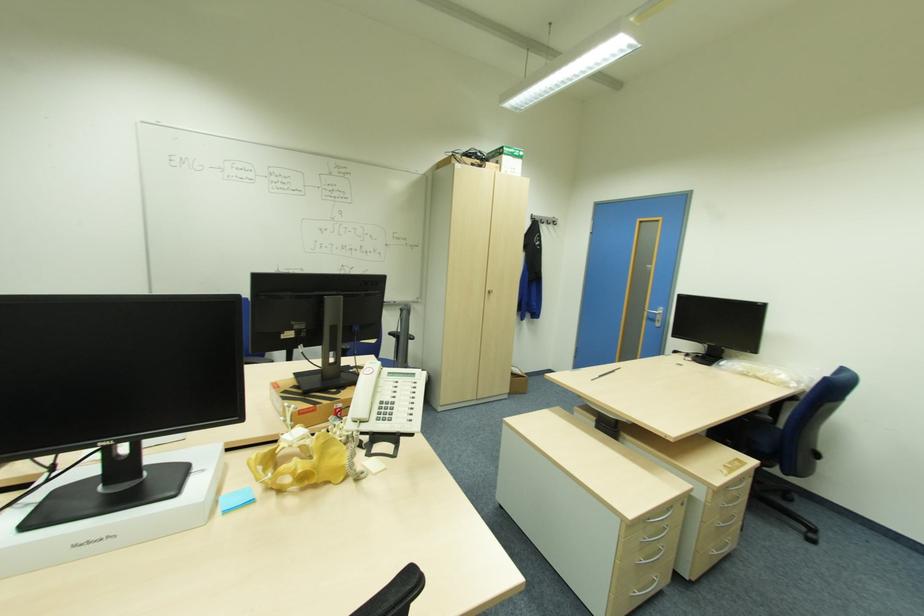
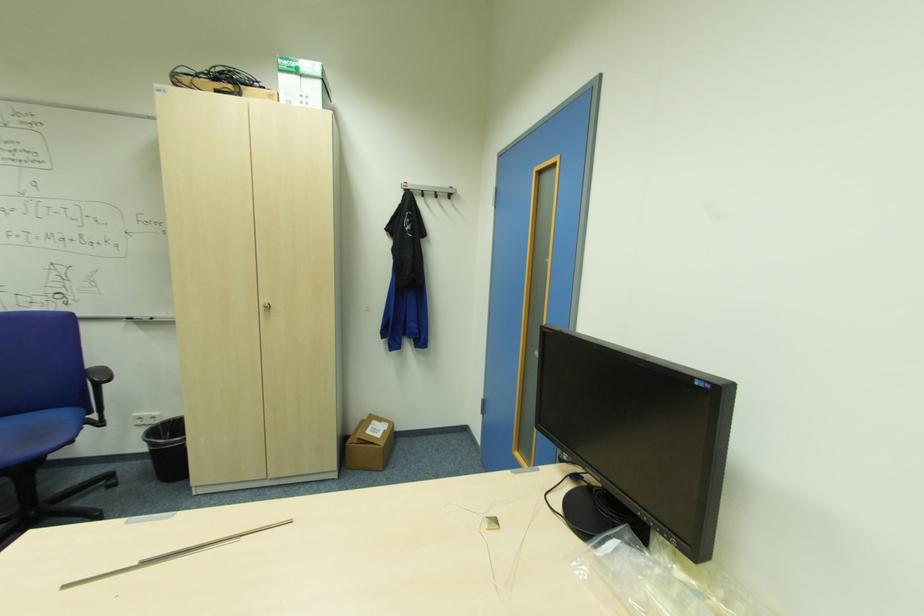
Find the pixel in the second image that matches pixel 416 339 in the first image.

(110, 381)